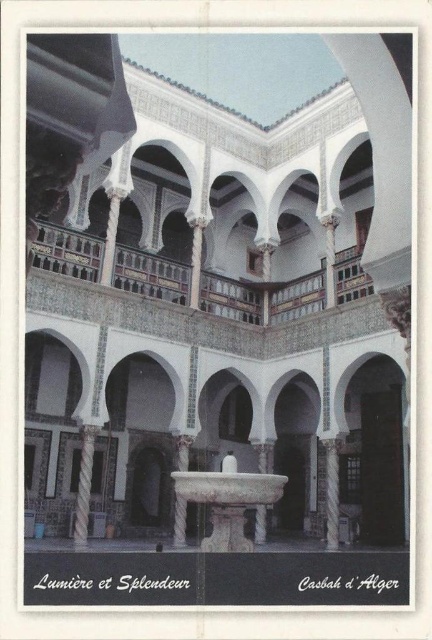
In the scene shown: Based on the scene description and the provided coordinates, what is located at the point marked as point (225, 502)?

The point (225, 502) indicates a white marble fountain at center.

You are an architect visiting the courtyard and need to place a new statue that is 1.5 meters wide. The statue must be placed near the white marble fountain at center and the white marble pillar at left. Which object can accommodate the statue without blocking the view of the other?

The white marble fountain at center has a larger size compared to the white marble pillar at left, so placing the statue near the fountain would provide enough space while keeping the pillar visible.